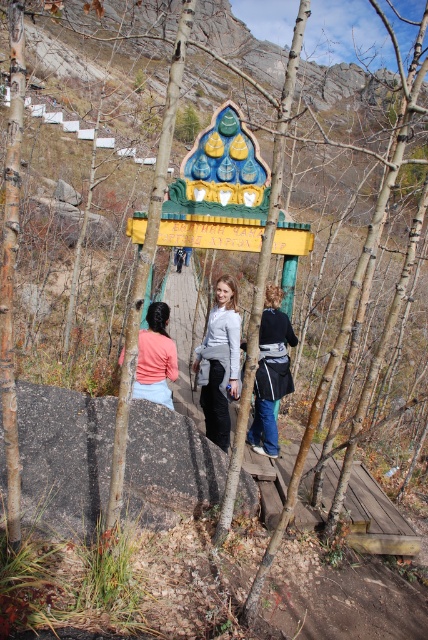
You are standing at the midpoint of the wooden bridge and see two points marked on the bridge. The first point is at coordinates point [101,440] and the second point is at point [172,317]. If you were to walk towards the first point, would you be moving towards the front or the back of the bridge?

Since point [101,440] is in front of point [172,317], walking towards the first point would mean moving towards the front of the bridge.

You are standing on the wooden bridge and want to walk towards the midpoint structure. Which point, point [264,337] or point [183,388], is closer to you as you start walking towards the structure?

Point [264,337] is closer to the camera than point [183,388], so it is closer to you as you start walking towards the midpoint structure.

You are standing on the wooden bridge and notice two items of clothing at the center. Which one is positioned higher between the matte pink fabric at center and the matte pink sweater at center?

The matte pink fabric at center is located above the matte pink sweater at center, so it is positioned higher.